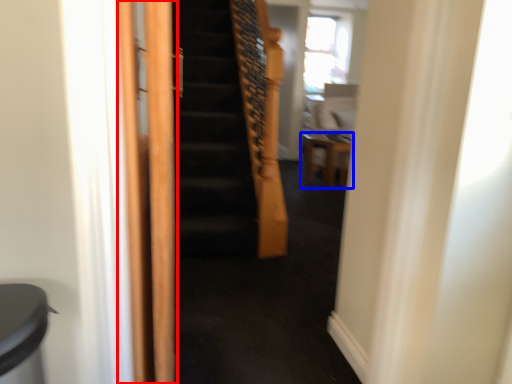
Question: Among these objects, which one is farthest to the camera, screen door (highlighted by a red box) or furniture (highlighted by a blue box)?

Choices:
 (A) screen door
 (B) furniture

Answer: (B)